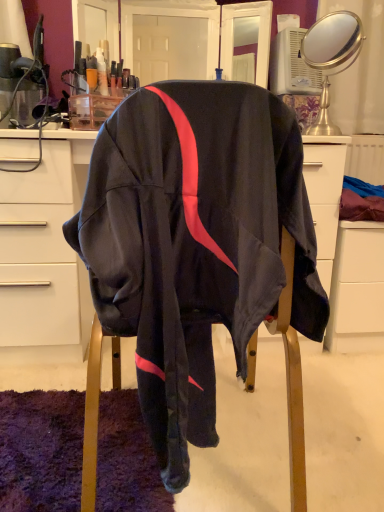
What is the approximate width of matte white desk at center?

The width of matte white desk at center is 19.36 inches.

Measure the distance between point (318, 51) and camera.

Point (318, 51) and camera are 2.57 meters apart from each other.

At what (x,y) coordinates should I click in order to perform the action: click on matte white desk at center. Please return your answer as a coordinate pair (x, y). Looking at the image, I should click on [44, 257].

Which is closer, (12,228) or (337,13)?

Point (12,228) appears to be closer to the viewer than point (337,13).

Who is smaller, matte white desk at center or gold metallic mirror at upper right?

Smaller between the two is gold metallic mirror at upper right.

The height and width of the screenshot is (512, 384). Find the location of `desk below the gold metallic mirror at upper right (from the image's perspective)`. desk below the gold metallic mirror at upper right (from the image's perspective) is located at coordinates (44, 257).

Can you confirm if matte white desk at center is shorter than gold metallic mirror at upper right?

No.

Which of these two, gold metallic mirror at upper right or white matte file cabinet at lower right, is bigger?

Bigger between the two is white matte file cabinet at lower right.

Which is correct: gold metallic mirror at upper right is inside white matte file cabinet at lower right, or outside of it?

gold metallic mirror at upper right lies outside white matte file cabinet at lower right.

Considering the relative positions of gold metallic mirror at upper right and white matte file cabinet at lower right in the image provided, is gold metallic mirror at upper right to the right of white matte file cabinet at lower right from the viewer's perspective?

Incorrect, gold metallic mirror at upper right is not on the right side of white matte file cabinet at lower right.

Relative to gold metallic mirror at upper right, is white matte file cabinet at lower right in front or behind?

white matte file cabinet at lower right is positioned farther from the viewer than gold metallic mirror at upper right.

Which of these two, white matte file cabinet at lower right or gold metallic mirror at upper right, stands taller?

Answer: Standing taller between the two is white matte file cabinet at lower right.

Which of these two, white matte file cabinet at lower right or gold metallic mirror at upper right, is wider?

white matte file cabinet at lower right.

Considering the relative sizes of white matte file cabinet at lower right and gold metallic mirror at upper right in the image provided, is white matte file cabinet at lower right smaller than gold metallic mirror at upper right?

Incorrect, white matte file cabinet at lower right is not smaller in size than gold metallic mirror at upper right.

How many degrees apart are the facing directions of gold metallic mirror at upper right and matte white desk at center?

There is a 47.2-degree angle between the facing directions of gold metallic mirror at upper right and matte white desk at center.

Looking at this image, from a real-world perspective, between gold metallic mirror at upper right and matte white desk at center, who is vertically higher?

gold metallic mirror at upper right.

Consider the image. Measure the distance between gold metallic mirror at upper right and matte white desk at center.

A distance of 1.14 meters exists between gold metallic mirror at upper right and matte white desk at center.

Are gold metallic mirror at upper right and matte white desk at center beside each other?

gold metallic mirror at upper right and matte white desk at center are not in contact.

How much distance is there between matte white desk at center and white matte file cabinet at lower right?

A distance of 95.16 centimeters exists between matte white desk at center and white matte file cabinet at lower right.

Which object is further away from the camera, matte white desk at center or white matte file cabinet at lower right?

Positioned behind is white matte file cabinet at lower right.

Considering the sizes of objects matte white desk at center and white matte file cabinet at lower right in the image provided, who is thinner, matte white desk at center or white matte file cabinet at lower right?

With smaller width is white matte file cabinet at lower right.

Visually, is matte white desk at center positioned to the left or to the right of white matte file cabinet at lower right?

matte white desk at center is positioned on white matte file cabinet at lower right's left side.

Between white matte file cabinet at lower right and matte white desk at center, which one has larger width?

Answer: matte white desk at center is wider.

Looking at this image, from the image's perspective, which object appears higher, white matte file cabinet at lower right or matte white desk at center?

matte white desk at center, from the image's perspective.

In order to click on file cabinet below the matte white desk at center (from the image's perspective) in this screenshot , I will do `click(357, 289)`.

Can you confirm if white matte file cabinet at lower right is bigger than matte white desk at center?

No, white matte file cabinet at lower right is not bigger than matte white desk at center.

Image resolution: width=384 pixels, height=512 pixels. Identify the location of desk that is under the gold metallic mirror at upper right (from a real-world perspective). (44, 257).

This screenshot has width=384, height=512. In order to click on mirror above the white matte file cabinet at lower right (from a real-world perspective) in this screenshot , I will do `click(331, 58)`.

Looking at the image, which one is located further to white matte file cabinet at lower right, gold metallic mirror at upper right or matte white desk at center?

matte white desk at center.

Considering their positions, is white matte file cabinet at lower right positioned further to matte white desk at center than gold metallic mirror at upper right?

Based on the image, gold metallic mirror at upper right appears to be further to matte white desk at center.

Estimate the real-world distances between objects in this image. Which object is closer to white matte file cabinet at lower right, matte white desk at center or gold metallic mirror at upper right?

gold metallic mirror at upper right is positioned closer to the anchor white matte file cabinet at lower right.

Which object lies nearer to the anchor point matte white desk at center, gold metallic mirror at upper right or white matte file cabinet at lower right?

white matte file cabinet at lower right.

Estimate the real-world distances between objects in this image. Which object is further from gold metallic mirror at upper right, white matte file cabinet at lower right or matte white desk at center?

matte white desk at center.

Considering their positions, is matte white desk at center positioned closer to gold metallic mirror at upper right than white matte file cabinet at lower right?

Based on the image, white matte file cabinet at lower right appears to be nearer to gold metallic mirror at upper right.

Where is `mirror between matte white desk at center and white matte file cabinet at lower right from left to right`? mirror between matte white desk at center and white matte file cabinet at lower right from left to right is located at coordinates (331, 58).